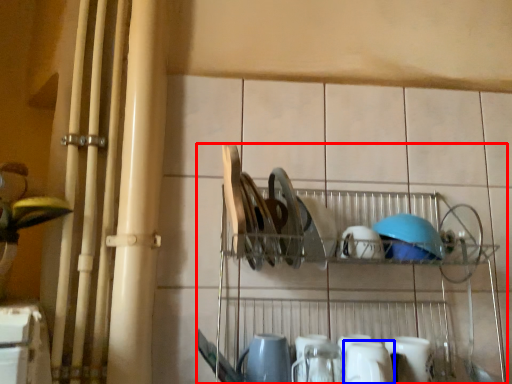
Question: Which of the following is the closest to the observer, shelf (highlighted by a red box) or tableware (highlighted by a blue box)?

Choices:
 (A) shelf
 (B) tableware

Answer: (A)